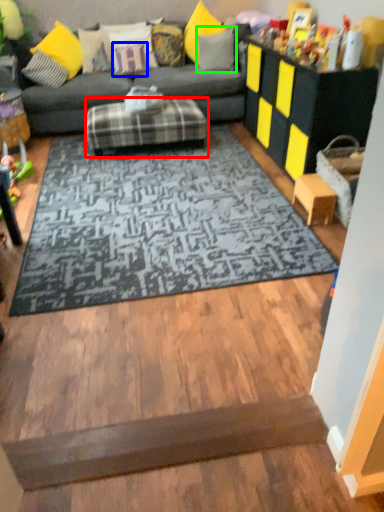
Question: Based on their relative distances, which object is nearer to footrest (highlighted by a red box)? Choose from pillow (highlighted by a blue box) and pillow (highlighted by a green box).

Choices:
 (A) pillow
 (B) pillow

Answer: (A)